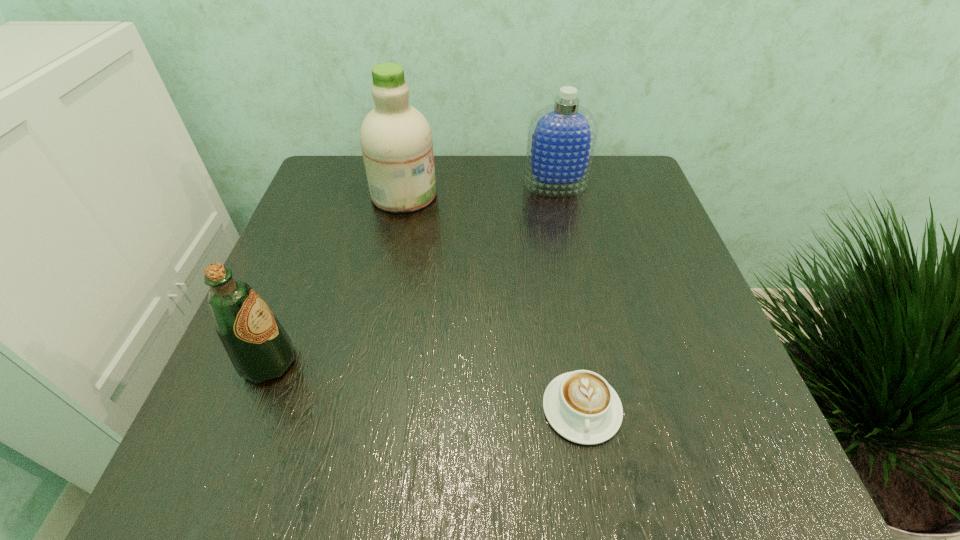
Locate an element on the screen. cleansing agent present at the left edge is located at coordinates (396, 140).

At what (x,y) coordinates should I click in order to perform the action: click on olive oil that is at the left edge. Please return your answer as a coordinate pair (x, y). The height and width of the screenshot is (540, 960). Looking at the image, I should click on (259, 348).

Locate an element on the screen. This screenshot has width=960, height=540. object at the right edge is located at coordinates [x=562, y=136].

What are the coordinates of `object that is at the far left corner` in the screenshot? It's located at (396, 140).

Identify the location of object that is at the far right corner. This screenshot has height=540, width=960. (562, 136).

In the image, there is a desktop. Where is `free space at the far edge`? Image resolution: width=960 pixels, height=540 pixels. free space at the far edge is located at coordinates [x=574, y=197].

Locate an element on the screen. Image resolution: width=960 pixels, height=540 pixels. free space at the near edge of the desktop is located at coordinates (627, 430).

Where is `blank space at the left edge of the desktop`? The width and height of the screenshot is (960, 540). blank space at the left edge of the desktop is located at coordinates (349, 234).

Where is `free space at the right edge of the desktop`? free space at the right edge of the desktop is located at coordinates (733, 410).

In the image, there is a desktop. Where is `vacant space at the far left corner`? vacant space at the far left corner is located at coordinates (338, 170).